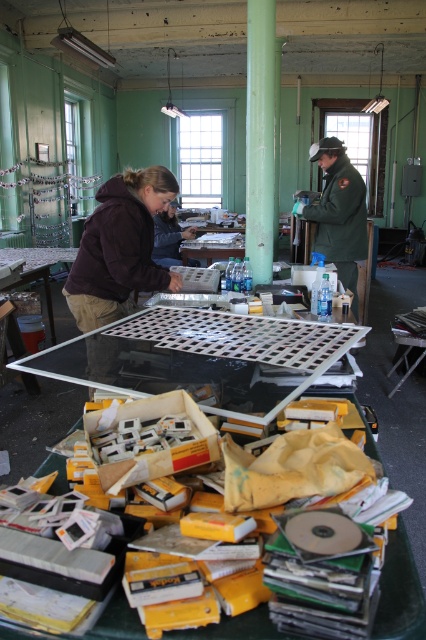
Who is taller, dark brown hoodie at center or brown fabric jacket at upper center?

With more height is dark brown hoodie at center.

Is dark brown hoodie at center wider than brown fabric jacket at upper center?

Yes.

The image size is (426, 640). In order to click on dark brown hoodie at center in this screenshot , I will do `click(120, 248)`.

Can you confirm if green uniform at center is positioned below brown fabric jacket at upper center?

Yes, green uniform at center is below brown fabric jacket at upper center.

Based on the photo, who is higher up, green uniform at center or brown fabric jacket at upper center?

brown fabric jacket at upper center is higher up.

Which is behind, point (360, 244) or point (167, 204)?

The point (360, 244) is more distant.

The width and height of the screenshot is (426, 640). What are the coordinates of `green uniform at center` in the screenshot? It's located at (339, 214).

Does point (94, 228) come closer to viewer compared to point (334, 147)?

Yes, point (94, 228) is in front of point (334, 147).

Can you confirm if dark brown hoodie at center is bigger than green uniform at center?

No.

Is point (88, 298) farther from camera compared to point (353, 257)?

No, (88, 298) is closer to viewer.

What are the coordinates of `dark brown hoodie at center` in the screenshot? It's located at (120, 248).